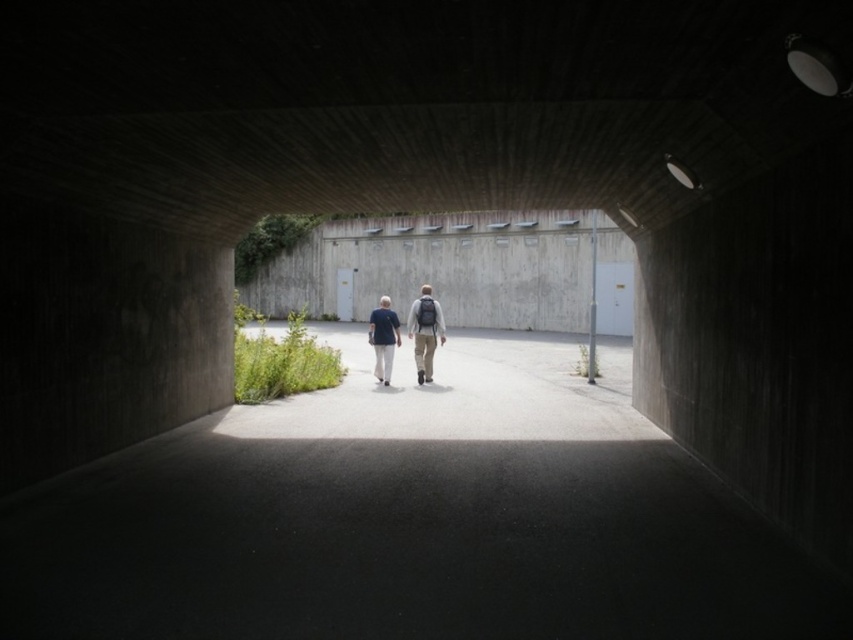
Question: Which object is the farthest from the light blue fabric at center?

Choices:
 (A) matte gray backpack at center
 (B) blue cotton shirt at center

Answer: (B)

Question: In this image, where is light blue fabric at center located relative to blue cotton shirt at center?

Choices:
 (A) left
 (B) right

Answer: (B)

Question: Can you confirm if light blue fabric at center is wider than matte gray backpack at center?

Choices:
 (A) yes
 (B) no

Answer: (A)

Question: Which point is farther from the camera taking this photo?

Choices:
 (A) (427, 323)
 (B) (425, 310)

Answer: (A)

Question: Is matte gray backpack at center wider than blue cotton shirt at center?

Choices:
 (A) yes
 (B) no

Answer: (B)

Question: Which point is closer to the camera taking this photo?

Choices:
 (A) (383, 324)
 (B) (378, 364)

Answer: (A)